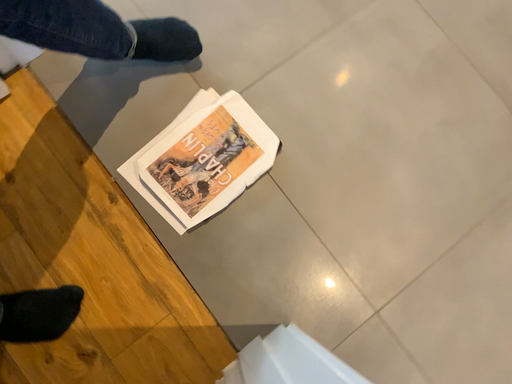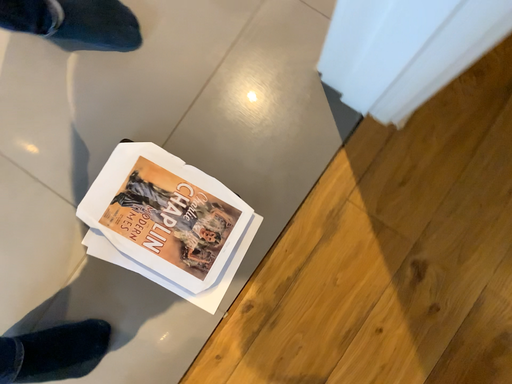
Question: How did the camera likely rotate when shooting the video?

Choices:
 (A) rotated left
 (B) rotated right

Answer: (B)